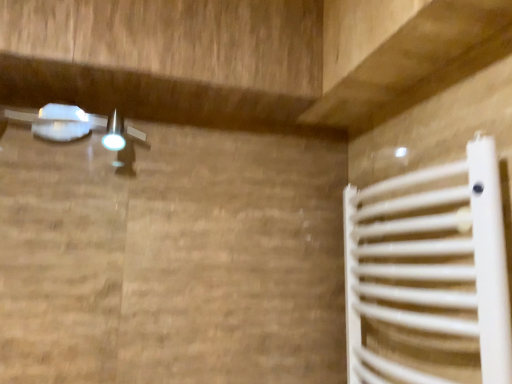
What do you see at coordinates (430, 275) in the screenshot?
I see `white matte radiator at lower right` at bounding box center [430, 275].

At what (x,y) coordinates should I click in order to perform the action: click on white matte radiator at lower right. Please return your answer as a coordinate pair (x, y). The width and height of the screenshot is (512, 384). Looking at the image, I should click on (430, 275).

You are a GUI agent. You are given a task and a screenshot of the screen. Output one action in this format:
    pyautogui.click(x=<x>, y=<y>)
    Task: Click on the white matte radiator at lower right
    The height and width of the screenshot is (384, 512).
    Given the screenshot: What is the action you would take?
    pyautogui.click(x=430, y=275)